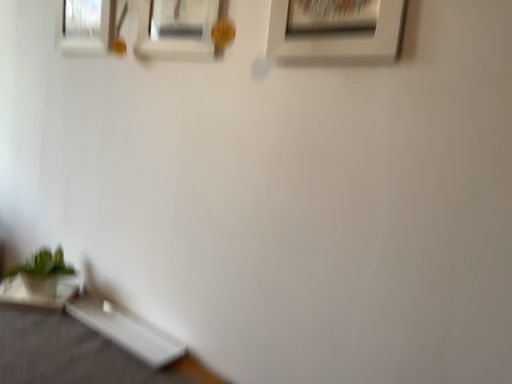
This screenshot has height=384, width=512. I want to click on white matte picture frame at upper center, marked as the 2th picture frame in a left-to-right arrangement, so click(178, 29).

What is the approximate height of white matte picture frame at upper center, which appears as the second picture frame when viewed from the front?

white matte picture frame at upper center, which appears as the second picture frame when viewed from the front, is 15.17 inches tall.

Find the location of a particular element. Image resolution: width=512 pixels, height=384 pixels. matte glass picture frame at upper left, placed as the 1th picture frame when sorted from back to front is located at coordinates (86, 27).

Image resolution: width=512 pixels, height=384 pixels. In order to click on white glossy table at lower left, the 1th table positioned from the right in this screenshot , I will do `click(126, 330)`.

The image size is (512, 384). Find the location of `white matte picture frame at upper center, arranged as the 2th picture frame when viewed from the right`. white matte picture frame at upper center, arranged as the 2th picture frame when viewed from the right is located at coordinates (178, 29).

Image resolution: width=512 pixels, height=384 pixels. Find the location of `the 2nd picture frame in front of the matte glass picture frame at upper left, placed as the 1th picture frame when sorted from back to front`. the 2nd picture frame in front of the matte glass picture frame at upper left, placed as the 1th picture frame when sorted from back to front is located at coordinates (336, 37).

From the image's perspective, which object appears higher, matte glass picture frame at upper left, positioned as the first picture frame in left-to-right order, or white matte picture frame at upper center, marked as the 1th picture frame in a right-to-left arrangement?

From the image's view, matte glass picture frame at upper left, positioned as the first picture frame in left-to-right order, is above.

Can you see matte glass picture frame at upper left, positioned as the first picture frame in left-to-right order, touching white matte picture frame at upper center, which is counted as the third picture frame, starting from the back?

No, matte glass picture frame at upper left, positioned as the first picture frame in left-to-right order, is not next to white matte picture frame at upper center, which is counted as the third picture frame, starting from the back.

Considering the relative sizes of matte glass picture frame at upper left, placed as the 1th picture frame when sorted from back to front, and white matte picture frame at upper center, marked as the 1th picture frame in a right-to-left arrangement, in the image provided, is matte glass picture frame at upper left, placed as the 1th picture frame when sorted from back to front, thinner than white matte picture frame at upper center, marked as the 1th picture frame in a right-to-left arrangement,?

Yes, matte glass picture frame at upper left, placed as the 1th picture frame when sorted from back to front, is thinner than white matte picture frame at upper center, marked as the 1th picture frame in a right-to-left arrangement.

Does point (191, 36) appear closer or farther from the camera than point (400, 23)?

Clearly, point (191, 36) is more distant from the camera than point (400, 23).

From a real-world perspective, is white matte picture frame at upper center, arranged as the 2th picture frame when viewed from the right, positioned under white matte picture frame at upper center, marked as the third picture frame in a left-to-right arrangement, based on gravity?

Indeed, from a real-world perspective, white matte picture frame at upper center, arranged as the 2th picture frame when viewed from the right, is positioned beneath white matte picture frame at upper center, marked as the third picture frame in a left-to-right arrangement.

How different are the orientations of white matte picture frame at upper center, which appears as the second picture frame when viewed from the back, and white matte picture frame at upper center, acting as the first picture frame starting from the front, in degrees?

They differ by 0.00345 degrees in their facing directions.

From the image's perspective, relative to white glossy table at lower left, which appears as the second table when viewed from the left, is green matte plant at lower left above or below?

green matte plant at lower left is above white glossy table at lower left, which appears as the second table when viewed from the left.

Considering the sizes of objects green matte plant at lower left and white glossy table at lower left, which appears as the second table when viewed from the left, in the image provided, who is wider, green matte plant at lower left or white glossy table at lower left, which appears as the second table when viewed from the left,?

Wider between the two is green matte plant at lower left.

Considering the sizes of objects green matte plant at lower left and white glossy table at lower left, which appears as the second table when viewed from the left, in the image provided, who is taller, green matte plant at lower left or white glossy table at lower left, which appears as the second table when viewed from the left,?

Standing taller between the two is green matte plant at lower left.

Is point (69, 272) farther from camera compared to point (113, 325)?

Yes, point (69, 272) is behind point (113, 325).

Which is nearer, (81,318) or (77,27)?

The point (81,318) is closer.

Which of these two, white glossy table at lower left, which appears as the second table when viewed from the left, or matte glass picture frame at upper left, placed as the 1th picture frame when sorted from back to front, is wider?

With larger width is white glossy table at lower left, which appears as the second table when viewed from the left.

Between white glossy table at lower left, which appears as the second table when viewed from the left, and matte glass picture frame at upper left, positioned as the first picture frame in left-to-right order, which one is positioned behind?

matte glass picture frame at upper left, positioned as the first picture frame in left-to-right order, is further from the camera.

Considering the sizes of objects white glossy table at lower left, which appears as the second table when viewed from the left, and matte glass picture frame at upper left, placed as the 1th picture frame when sorted from back to front, in the image provided, who is bigger, white glossy table at lower left, which appears as the second table when viewed from the left, or matte glass picture frame at upper left, placed as the 1th picture frame when sorted from back to front,?

matte glass picture frame at upper left, placed as the 1th picture frame when sorted from back to front.

Looking at this image, is green matte plant at lower left beside white matte picture frame at upper center, which is counted as the third picture frame, starting from the back?

green matte plant at lower left is not next to white matte picture frame at upper center, which is counted as the third picture frame, starting from the back, and they're not touching.

Is green matte plant at lower left in front of or behind white matte picture frame at upper center, marked as the 1th picture frame in a right-to-left arrangement, in the image?

green matte plant at lower left is behind white matte picture frame at upper center, marked as the 1th picture frame in a right-to-left arrangement.

Which is closer, (42, 279) or (279, 5)?

Point (42, 279) appears to be farther away from the viewer than point (279, 5).

Where is `the 2nd table to the left when counting from the white matte picture frame at upper center, marked as the 1th picture frame in a right-to-left arrangement`? the 2nd table to the left when counting from the white matte picture frame at upper center, marked as the 1th picture frame in a right-to-left arrangement is located at coordinates (40, 290).

Is white glossy table at lower left, which ranks as the 2th table in right-to-left order, touching white matte picture frame at upper center, acting as the first picture frame starting from the front?

They are not placed beside each other.

Between point (12, 289) and point (389, 44), which one is positioned in front?

The point (389, 44) is closer.

Between white matte picture frame at upper center, which is counted as the third picture frame, starting from the back, and matte glass picture frame at upper left, the third picture frame in the front-to-back sequence, which one has less height?

matte glass picture frame at upper left, the third picture frame in the front-to-back sequence.

What are the coordinates of `the 2nd picture frame directly beneath the white matte picture frame at upper center, marked as the third picture frame in a left-to-right arrangement (from a real-world perspective)` in the screenshot? It's located at (86, 27).

From a real-world perspective, between white matte picture frame at upper center, marked as the 1th picture frame in a right-to-left arrangement, and matte glass picture frame at upper left, which is the 3th picture frame in right-to-left order, who is vertically lower?

matte glass picture frame at upper left, which is the 3th picture frame in right-to-left order.

Where is `picture frame that is the 2nd object to the right of the matte glass picture frame at upper left, the third picture frame in the front-to-back sequence, starting at the anchor`? The width and height of the screenshot is (512, 384). picture frame that is the 2nd object to the right of the matte glass picture frame at upper left, the third picture frame in the front-to-back sequence, starting at the anchor is located at coordinates (336, 37).

This screenshot has height=384, width=512. Find the location of `picture frame lying below the white matte picture frame at upper center, arranged as the 2th picture frame when viewed from the right (from the image's perspective)`. picture frame lying below the white matte picture frame at upper center, arranged as the 2th picture frame when viewed from the right (from the image's perspective) is located at coordinates (336, 37).

When comparing their distances from white matte picture frame at upper center, which appears as the second picture frame when viewed from the front, does matte glass picture frame at upper left, placed as the 1th picture frame when sorted from back to front, or green matte plant at lower left seem further?

Based on the image, green matte plant at lower left appears to be further to white matte picture frame at upper center, which appears as the second picture frame when viewed from the front.

From the image, which object appears to be farther from white matte picture frame at upper center, which appears as the second picture frame when viewed from the front, matte glass picture frame at upper left, the third picture frame in the front-to-back sequence, or white matte picture frame at upper center, which is counted as the third picture frame, starting from the back?

white matte picture frame at upper center, which is counted as the third picture frame, starting from the back, is positioned further to the anchor white matte picture frame at upper center, which appears as the second picture frame when viewed from the front.

Which object lies further to the anchor point white matte picture frame at upper center, acting as the first picture frame starting from the front, white glossy table at lower left, the 1th table from the left, or white matte picture frame at upper center, marked as the 2th picture frame in a left-to-right arrangement?

Among the two, white glossy table at lower left, the 1th table from the left, is located further to white matte picture frame at upper center, acting as the first picture frame starting from the front.

Estimate the real-world distances between objects in this image. Which object is further from white matte picture frame at upper center, which appears as the second picture frame when viewed from the back, white glossy table at lower left, which ranks as the 2th table in right-to-left order, or matte glass picture frame at upper left, which is the 3th picture frame in right-to-left order?

white glossy table at lower left, which ranks as the 2th table in right-to-left order, is further to white matte picture frame at upper center, which appears as the second picture frame when viewed from the back.

Looking at the image, which one is located further to green matte plant at lower left, matte glass picture frame at upper left, which is the 3th picture frame in right-to-left order, or white glossy table at lower left, the 1th table positioned from the right?

matte glass picture frame at upper left, which is the 3th picture frame in right-to-left order, lies further to green matte plant at lower left than the other object.

Based on their spatial positions, is matte glass picture frame at upper left, the third picture frame in the front-to-back sequence, or white glossy table at lower left, which ranks as the 2th table in right-to-left order, further from white matte picture frame at upper center, acting as the first picture frame starting from the front?

white glossy table at lower left, which ranks as the 2th table in right-to-left order, is positioned further to the anchor white matte picture frame at upper center, acting as the first picture frame starting from the front.

Considering their positions, is green matte plant at lower left positioned closer to white glossy table at lower left, the 1th table from the left, than white matte picture frame at upper center, acting as the first picture frame starting from the front?

green matte plant at lower left lies closer to white glossy table at lower left, the 1th table from the left, than the other object.

Considering their positions, is white matte picture frame at upper center, which appears as the second picture frame when viewed from the front, positioned further to white matte picture frame at upper center, marked as the third picture frame in a left-to-right arrangement, than white glossy table at lower left, which ranks as the 2th table in right-to-left order?

white glossy table at lower left, which ranks as the 2th table in right-to-left order, lies further to white matte picture frame at upper center, marked as the third picture frame in a left-to-right arrangement, than the other object.

The image size is (512, 384). Find the location of `houseplant between white glossy table at lower left, which ranks as the 2th table in right-to-left order, and white glossy table at lower left, which appears as the second table when viewed from the left`. houseplant between white glossy table at lower left, which ranks as the 2th table in right-to-left order, and white glossy table at lower left, which appears as the second table when viewed from the left is located at coordinates (41, 273).

Identify the location of table that lies between white matte picture frame at upper center, marked as the 1th picture frame in a right-to-left arrangement, and white glossy table at lower left, the 1th table positioned from the right, from top to bottom. (40, 290).

Locate an element on the screen. This screenshot has width=512, height=384. houseplant between white matte picture frame at upper center, which appears as the second picture frame when viewed from the front, and white glossy table at lower left, the 1th table positioned from the right, in the up-down direction is located at coordinates (41, 273).

In order to click on houseplant between white matte picture frame at upper center, marked as the 1th picture frame in a right-to-left arrangement, and white glossy table at lower left, which appears as the second table when viewed from the left, in the vertical direction in this screenshot , I will do `click(41, 273)`.